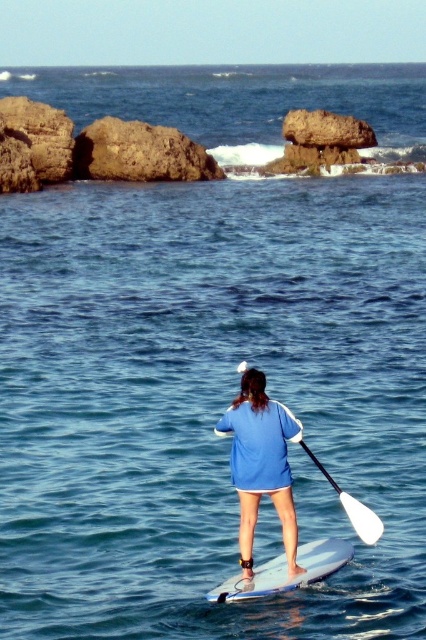
You are a photographer trying to capture the paddleboarder. You need to know if the white foam surfboard at center is wider than the white plastic paddle at center to adjust your camera angle. Can you confirm?

The white foam surfboard at center might be wider than white plastic paddle at center, so it is possible that the surfboard is wider. Adjust your camera angle accordingly.

You are a photographer trying to capture the person on the paddleboard. You want to frame the shot so that the blue fabric shirt at center is positioned to the left of the white foam surfboard at center. Is this possible based on the scene?

Yes, because the blue fabric shirt at center is already positioned to the left of the white foam surfboard at center according to the description.

You are a photographer trying to capture the paddleboarder in the image. You want to ensure the white foam surfboard at center and the white plastic paddle at center are both visible in your shot. Based on their positions, which object should you focus on first to frame the scene properly?

The white foam surfboard at center is to the left of the white plastic paddle at center, so you should focus on the white foam surfboard at center first to ensure both objects are framed correctly.